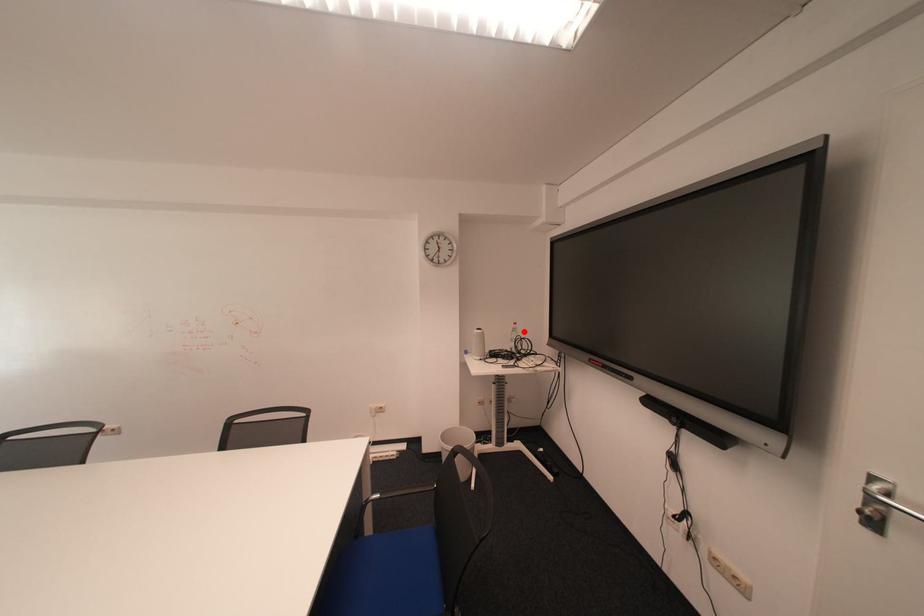
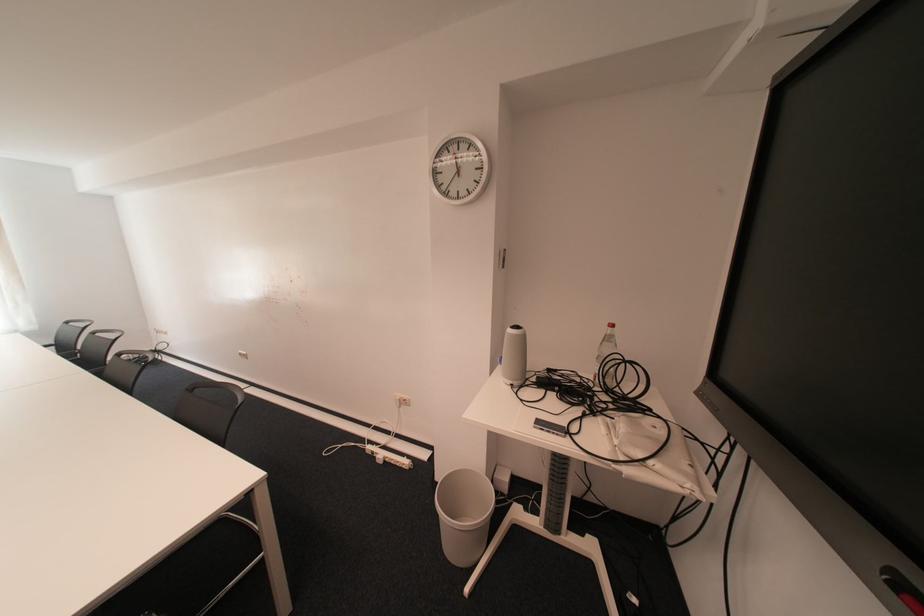
In the second image, find the point that corresponds to the highlighted location in the first image.

(614, 341)